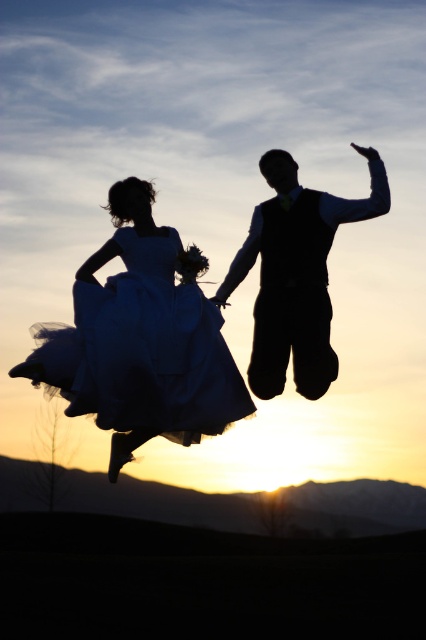
You are a photographer at a wedding and see the blue tulle dress at center and the white tulle dress at center. Which dress is closer to the camera?

The blue tulle dress at center is closer to the camera because the white tulle dress at center is behind it.

You are a photographer who wants to capture the two dresses in the image. Which dress is positioned lower in the frame between the blue tulle dress at center and the white tulle dress at center?

The blue tulle dress at center is positioned lower than the white tulle dress at center.

You are a photographer capturing the silhouette of a couple mid jump. You notice the white tulle dress at center and the silhouette vest at center. Which object is positioned in front of the other in the image?

The white tulle dress at center is closer to the viewer than the silhouette vest at center, so it is positioned in front of the silhouette vest at center.